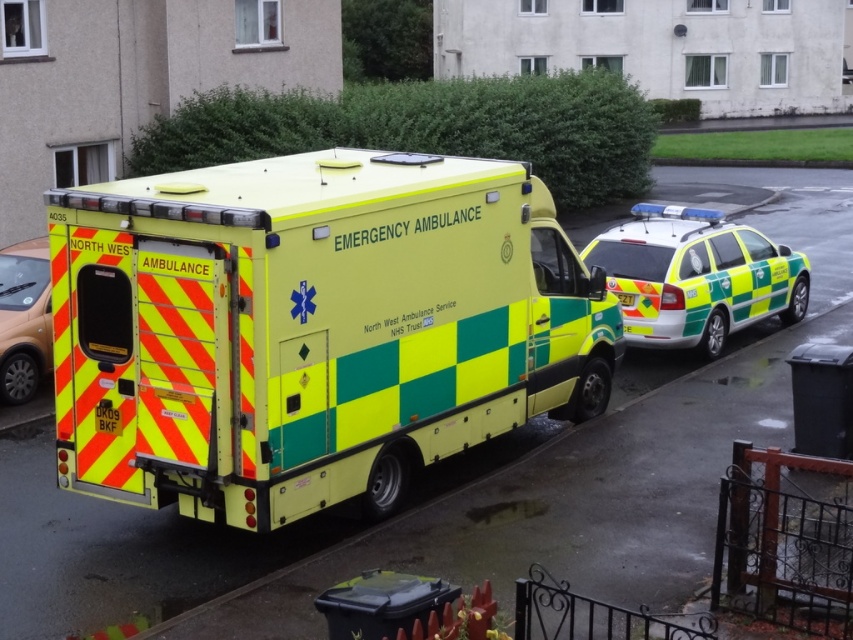
Question: Which object appears farthest from the camera in this image?

Choices:
 (A) matte orange car at left
 (B) green and yellow painted car at right

Answer: (B)

Question: Is yellow/green checkered plastic ambulance at center thinner than green and yellow painted car at right?

Choices:
 (A) yes
 (B) no

Answer: (B)

Question: Is yellow/green checkered plastic ambulance at center positioned in front of green and yellow painted car at right?

Choices:
 (A) no
 (B) yes

Answer: (B)

Question: Which point is farther from the camera taking this photo?

Choices:
 (A) (306, 316)
 (B) (708, 220)
 (C) (16, 381)

Answer: (B)

Question: Does green and yellow painted car at right have a greater width compared to matte orange car at left?

Choices:
 (A) yes
 (B) no

Answer: (A)

Question: Which point is farther to the camera?

Choices:
 (A) matte orange car at left
 (B) green and yellow painted car at right

Answer: (B)